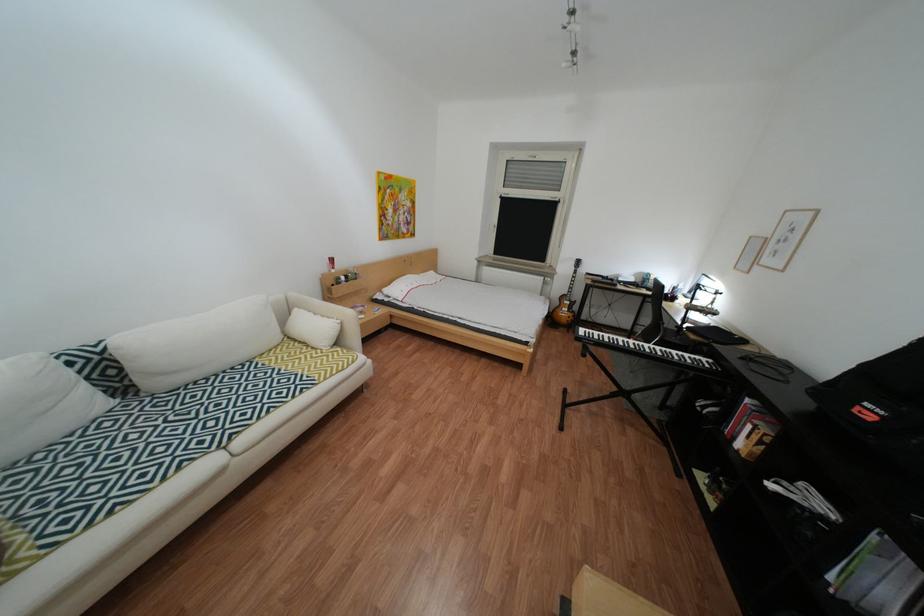
This screenshot has height=616, width=924. I want to click on black fabric bag, so click(x=881, y=405).